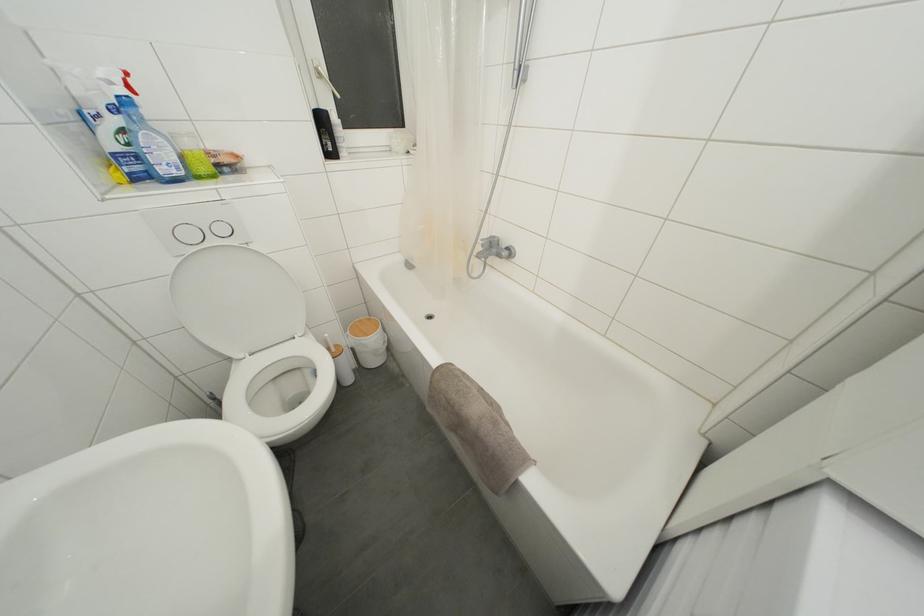
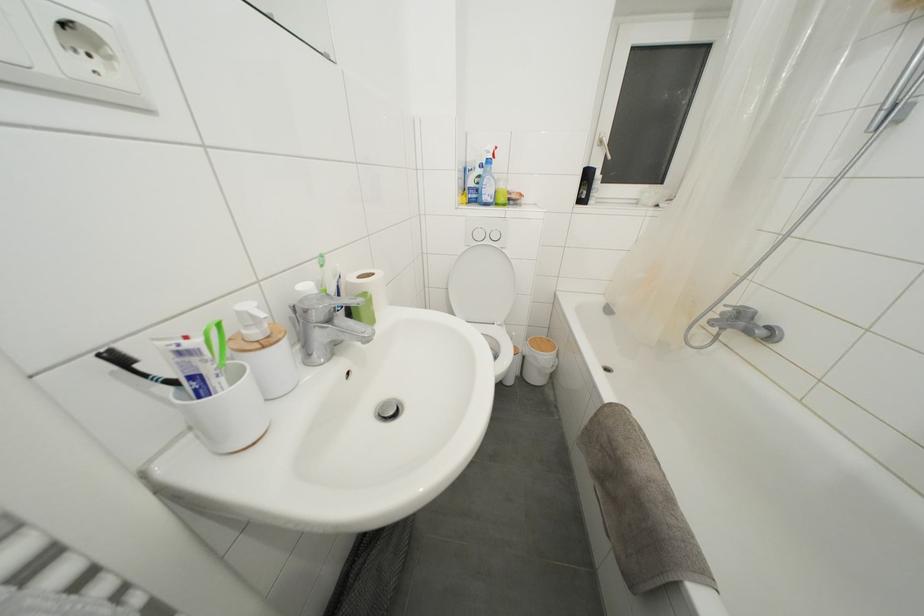
Question: The camera is either moving clockwise (left) or counter-clockwise (right) around the object. The first image is from the beginning of the video and the second image is from the end. Is the camera moving left or right when shooting the video?

Choices:
 (A) Left
 (B) Right

Answer: (B)